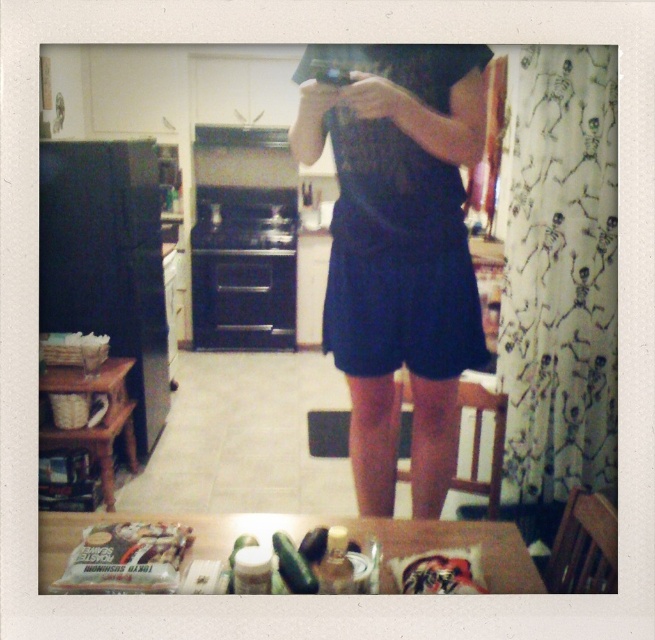
Question: Where is dark blue fabric dress at center located in relation to white matte bag of almond butter at lower left in the image?

Choices:
 (A) below
 (B) above

Answer: (B)

Question: Among these points, which one is farthest from the camera?

Choices:
 (A) (460, 241)
 (B) (122, 561)

Answer: (A)

Question: Does dark blue fabric dress at center appear under white matte bag of almond butter at lower left?

Choices:
 (A) yes
 (B) no

Answer: (B)

Question: Which object appears farthest from the camera in this image?

Choices:
 (A) dark blue fabric dress at center
 (B) white matte bag of almond butter at lower left

Answer: (A)

Question: Does dark blue fabric dress at center have a smaller size compared to white matte bag of almond butter at lower left?

Choices:
 (A) yes
 (B) no

Answer: (B)